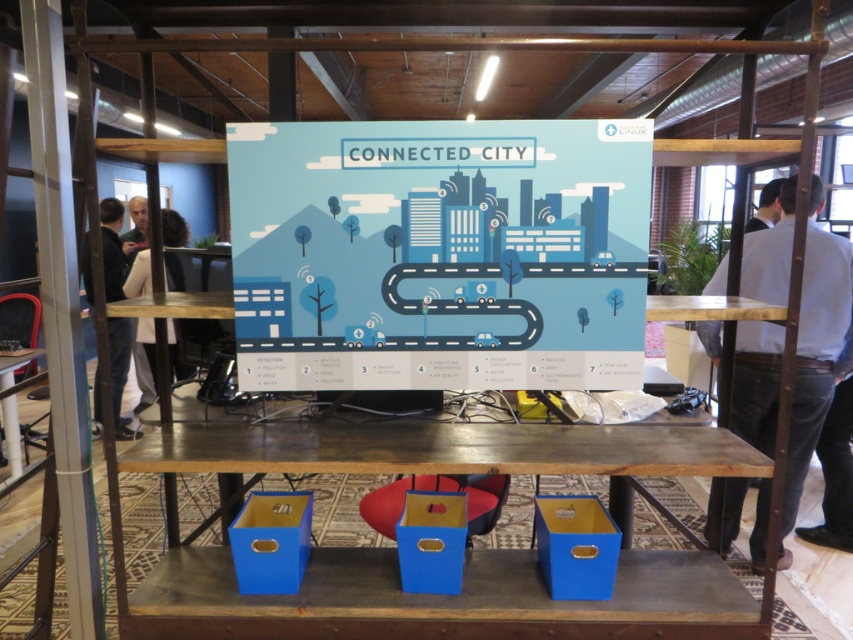
You are standing in front of the Connected City display and want to reach a point marked at coordinates point (399,292). If you can extend your arm 1.7 meters, will you be able to touch that point?

The distance between point (399,292) and the camera is 1.83 meters. Since your arm can only extend 1.7 meters, you cannot reach the point.

You are organizing an event and need to place a decorative item on the wooden table at center. However, there is a dark gray sweater at left in the way. Based on their positions, can you place the item on the table without moving the sweater?

The wooden table at center is below the dark gray sweater at left, so the sweater is positioned above the table. Since the sweater is above, you can place the decorative item on the table without moving the sweater as they are at different vertical levels.